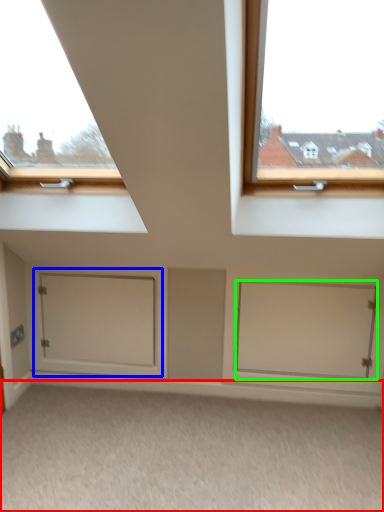
Question: Which object is positioned farthest from plain (highlighted by a red box)? Select from door (highlighted by a blue box) and door (highlighted by a green box).

Choices:
 (A) door
 (B) door

Answer: (A)